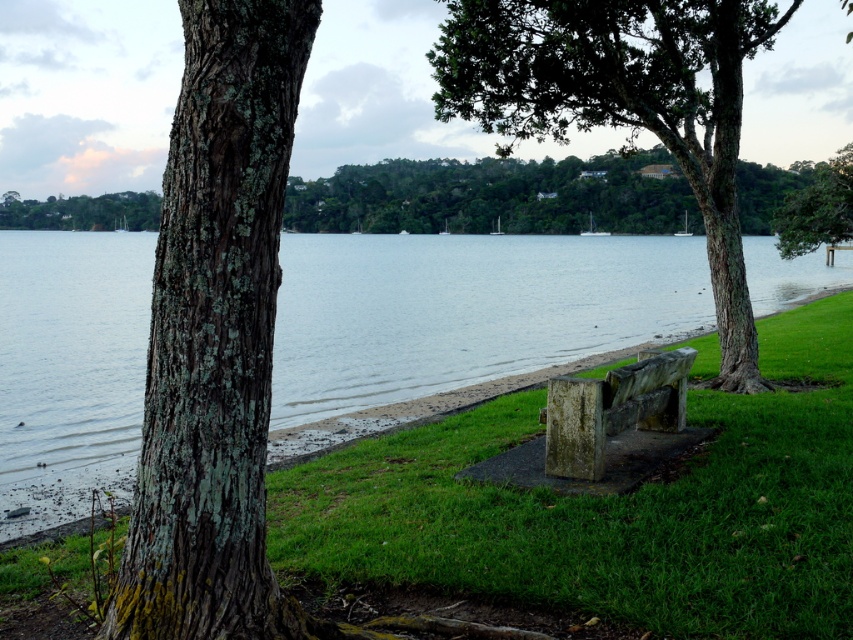
Question: Does green lichen-covered bark at left have a greater width compared to green lichen-covered tree at center-right?

Choices:
 (A) no
 (B) yes

Answer: (A)

Question: Among these objects, which one is nearest to the camera?

Choices:
 (A) green lichen-covered tree at center-right
 (B) green lichen-covered tree at upper center
 (C) rusty stone bench at center
 (D) green lichen-covered tree trunk at upper center

Answer: (C)

Question: Considering the real-world distances, which object is farthest from the green lichen-covered tree at center-right?

Choices:
 (A) green rough bark tree at center
 (B) green lichen-covered bark at left

Answer: (B)

Question: Which of these objects is positioned farthest from the green lichen-covered tree at center-right?

Choices:
 (A) green lichen-covered bark at left
 (B) green grassy bench at center
 (C) green rough bark tree at center
 (D) smooth water at center

Answer: (A)

Question: In this image, where is green rough bark tree at center located relative to green lichen-covered tree trunk at upper center?

Choices:
 (A) above
 (B) below

Answer: (B)

Question: Is green grassy bench at center wider than green lichen-covered tree at upper center?

Choices:
 (A) yes
 (B) no

Answer: (B)